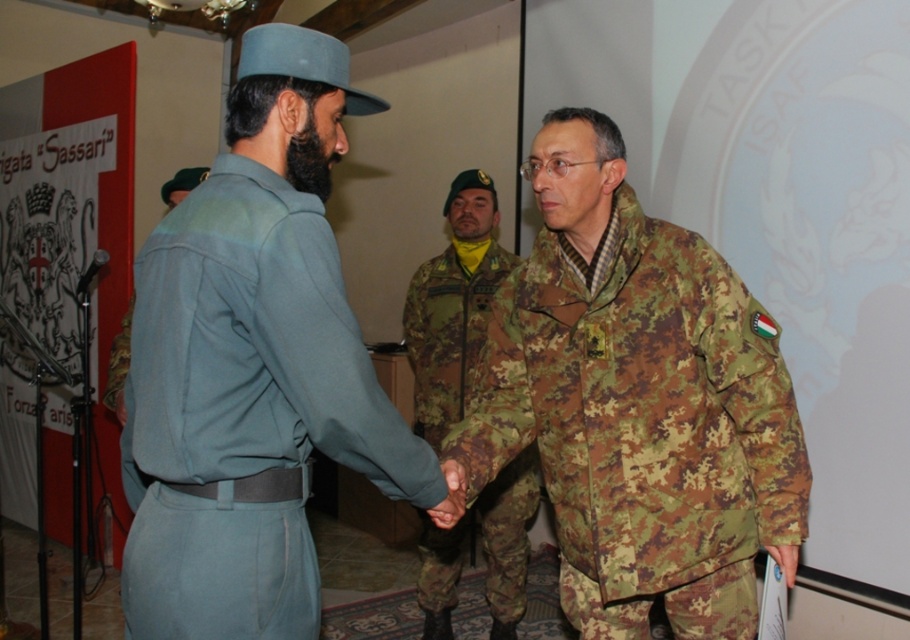
Question: Based on their relative distances, which object is farther from the camouflage fabric jacket at center?

Choices:
 (A) light blue uniform at center
 (B) camouflage fabric uniform at center

Answer: (B)

Question: Estimate the real-world distances between objects in this image. Which object is farther from the camouflage fabric jacket at center?

Choices:
 (A) camouflage fabric uniform at center
 (B) light blue uniform at center

Answer: (A)

Question: Is light blue uniform at center closer to the viewer compared to camouflage fabric jacket at center?

Choices:
 (A) no
 (B) yes

Answer: (B)

Question: Is light blue uniform at center positioned behind camouflage fabric uniform at center?

Choices:
 (A) no
 (B) yes

Answer: (A)

Question: Does light blue uniform at center have a smaller size compared to camouflage fabric jacket at center?

Choices:
 (A) no
 (B) yes

Answer: (B)

Question: Which is farther from the camouflage fabric uniform at center?

Choices:
 (A) camouflage fabric jacket at center
 (B) light blue uniform at center

Answer: (B)